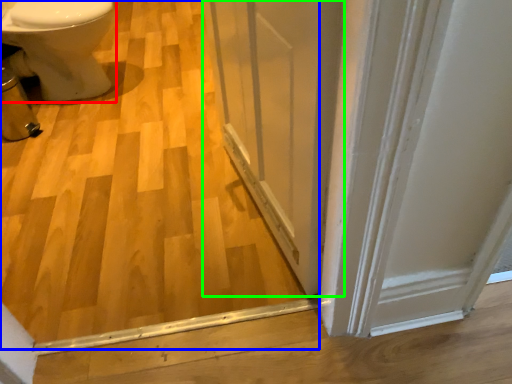
Question: Which is farther away from bidet (highlighted by a red box)? plywood (highlighted by a blue box) or screen door (highlighted by a green box)?

Choices:
 (A) plywood
 (B) screen door

Answer: (B)